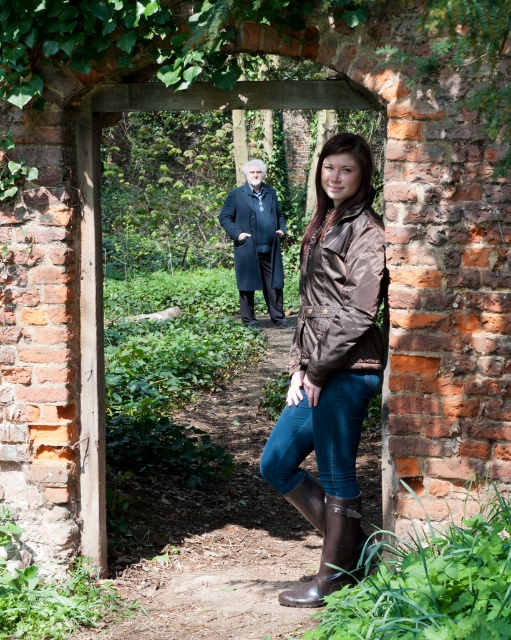
You are a photographer setting up a tripod in this scene. You need to position the camera so that both the brown satin jacket at center and the brown rubber boot at lower center are visible in the frame. However, the boot is currently partially hidden. Based on their positions, which object should you adjust to ensure the boot becomes fully visible?

The brown rubber boot at lower center is behind the brown satin jacket at center. To make the boot fully visible, you should move the brown satin jacket at center slightly forward or to the side so it no longer blocks the boot.

You are a photographer setting up a shot of the woman in the rustic archway. You want to ensure the brown satin jacket at center and the brown rubber boot at lower center are both in focus. Which object should you place closer to the camera to achieve this?

The brown satin jacket at center is positioned on the right side of brown rubber boot at lower center. To have both in focus, you should place the brown rubber boot at lower center closer to the camera since it is already lower and positioned to the left of the jacket, allowing the depth of field to cover both when focused appropriately.

You are a fashion stylist observing the scene and notice two coats on the woman. Which one is positioned lower on her body between the brown satin jacket at center and the dark blue wool coat at center?

The brown satin jacket at center is located below the dark blue wool coat at center, so it is positioned lower on her body.